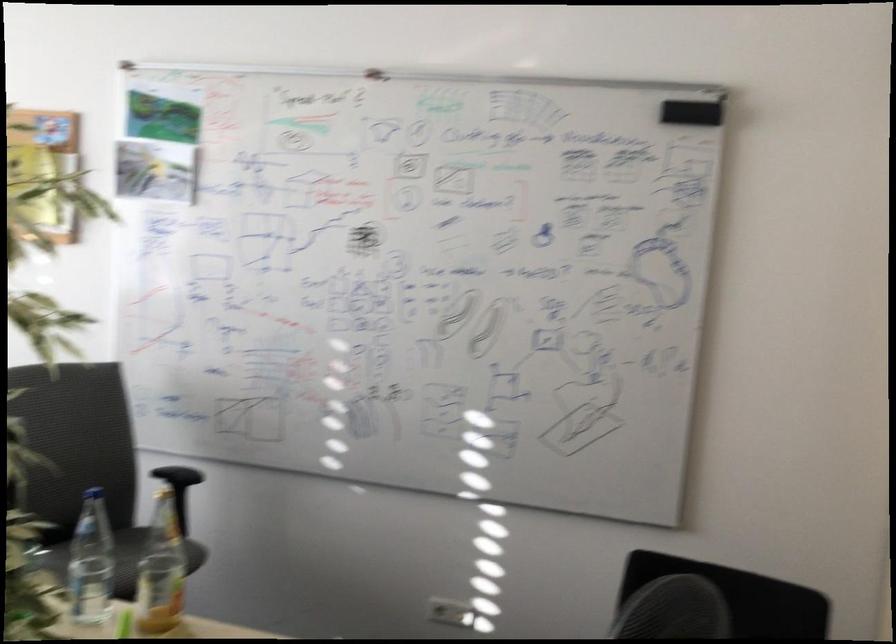
You are a GUI agent. You are given a task and a screenshot of the screen. Output one action in this format:
    pyautogui.click(x=<x>, y=<y>)
    Task: Click on the orange drink bottle
    The height and width of the screenshot is (644, 896).
    Given the screenshot: What is the action you would take?
    pyautogui.click(x=160, y=570)